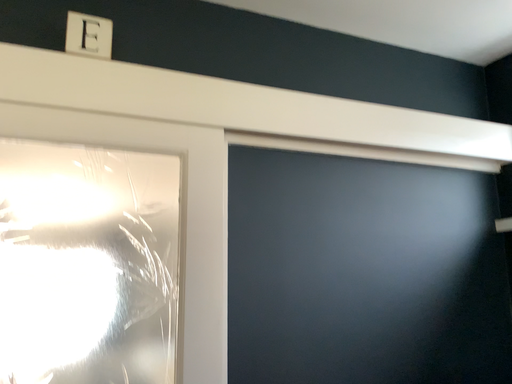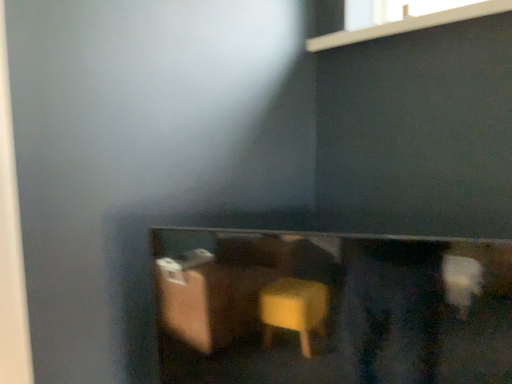
Question: Which way did the camera rotate in the video?

Choices:
 (A) rotated upward
 (B) rotated downward

Answer: (B)